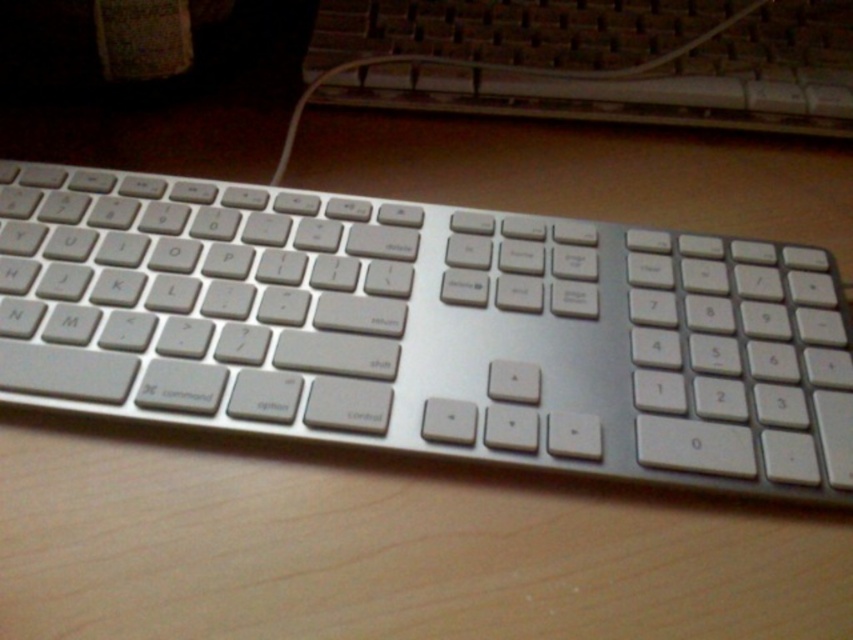
Consider the image. You are setting up a workspace and need to place two keyboards side by side on your desk. The silver metallic keyboard at center is to the left of the satin silver keyboard at upper center. Which keyboard should you move to the right if you want them aligned horizontally?

You should move the silver metallic keyboard at center to the right so it aligns with the satin silver keyboard at upper center since the silver metallic keyboard is currently positioned to the left of the satin silver keyboard at upper center.

You are setting up a workspace and have a silver metallic keyboard at center. You want to place another keyboard next to it without overlapping. What is the minimum distance you should leave between them?

The minimum distance you should leave between the silver metallic keyboard at center and the other keyboard is 30.25 centimeters to prevent overlapping.

You are trying to determine the position of two points on the desk. Which point, point (186, 419) or point (316, 38), is closer to you?

Point (186, 419) is closer to the viewer than point (316, 38).